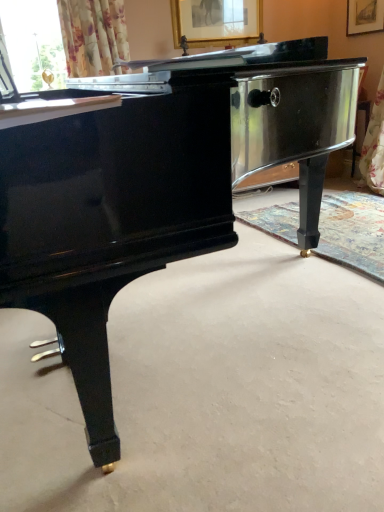
Question: From the image's perspective, is gold-framed picture at upper center positioned above or below gold metallic piano leg at center?

Choices:
 (A) above
 (B) below

Answer: (A)

Question: Considering the positions of point click(x=173, y=4) and point click(x=360, y=249), is point click(x=173, y=4) closer or farther from the camera than point click(x=360, y=249)?

Choices:
 (A) closer
 (B) farther

Answer: (B)

Question: In terms of size, does gold-framed picture at upper center appear bigger or smaller than gold metallic piano leg at center?

Choices:
 (A) big
 (B) small

Answer: (B)

Question: In terms of size, does gold metallic piano leg at center appear bigger or smaller than gold-framed picture at upper center?

Choices:
 (A) big
 (B) small

Answer: (A)

Question: Would you say gold metallic piano leg at center is to the left or to the right of gold-framed picture at upper center in the picture?

Choices:
 (A) left
 (B) right

Answer: (B)

Question: Relative to gold-framed picture at upper center, is gold metallic piano leg at center in front or behind?

Choices:
 (A) front
 (B) behind

Answer: (A)

Question: Looking at their shapes, would you say gold metallic piano leg at center is wider or thinner than gold-framed picture at upper center?

Choices:
 (A) thin
 (B) wide

Answer: (B)